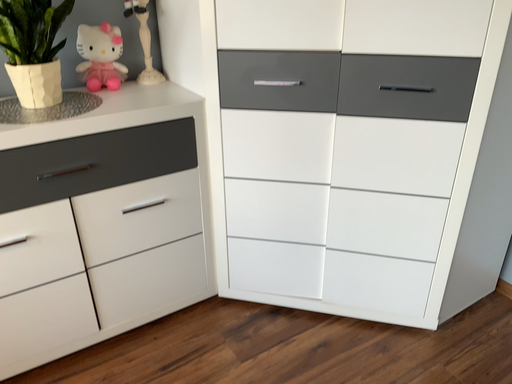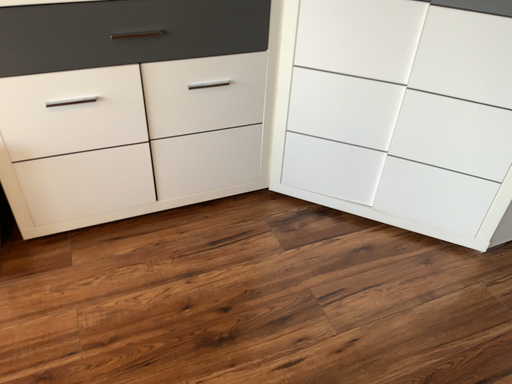
Question: Which way did the camera rotate in the video?

Choices:
 (A) rotated downward
 (B) rotated upward

Answer: (A)